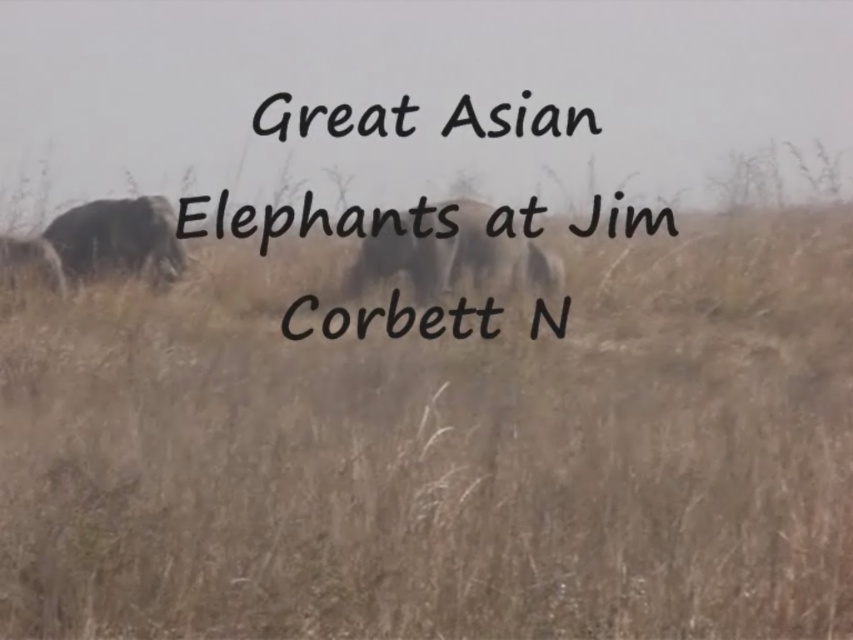
Does gray textured elephant at left appear on the left side of grayish-brown elephant at left?

Incorrect, gray textured elephant at left is not on the left side of grayish-brown elephant at left.

Locate an element on the screen. This screenshot has height=640, width=853. gray textured elephant at left is located at coordinates (119, 240).

Does point (422, 276) come in front of point (7, 262)?

That is False.

Describe the element at coordinates (456, 259) in the screenshot. I see `grayish-brown textured elephant at center` at that location.

Where is `grayish-brown textured elephant at center`? The image size is (853, 640). grayish-brown textured elephant at center is located at coordinates (456, 259).

Is grayish-brown textured elephant at center positioned before gray textured elephant at left?

Yes, grayish-brown textured elephant at center is in front of gray textured elephant at left.

Can you confirm if grayish-brown textured elephant at center is positioned above gray textured elephant at left?

Actually, grayish-brown textured elephant at center is below gray textured elephant at left.

Which is in front, point (456, 212) or point (96, 228)?

Point (456, 212) is in front.

Locate an element on the screen. grayish-brown textured elephant at center is located at coordinates (456, 259).